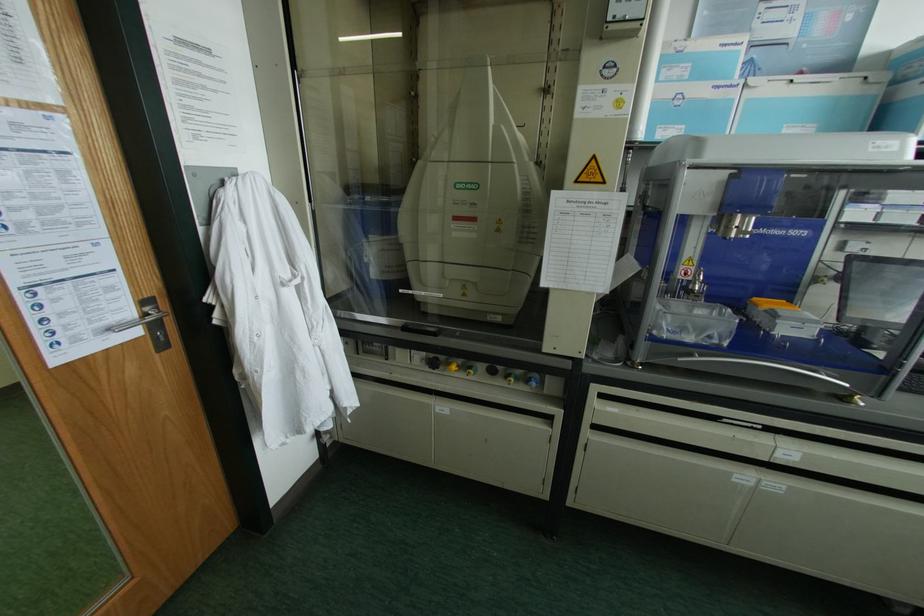
The width and height of the screenshot is (924, 616). What are the coordinates of `black control knob` in the screenshot? It's located at (432, 362).